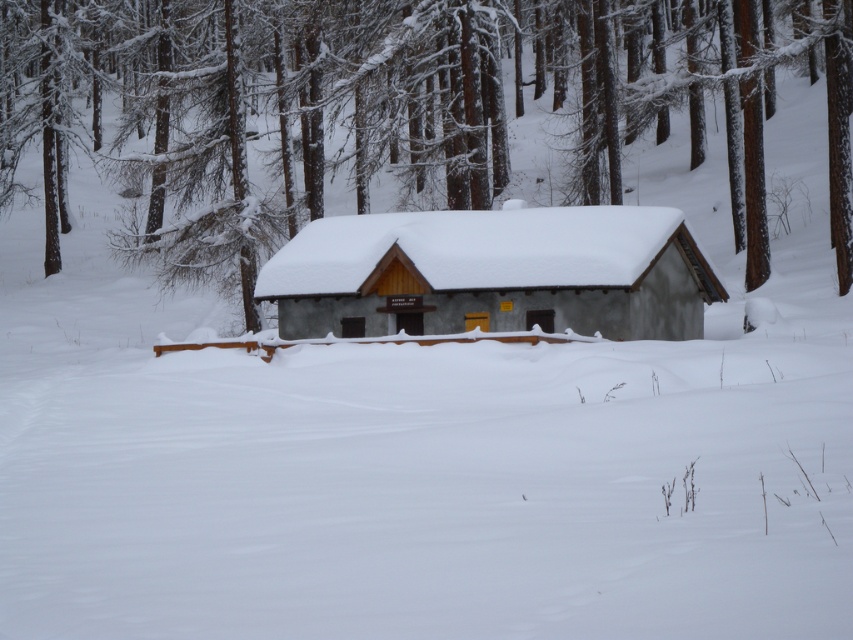
Does brown wood tree at center appear under smooth gray cabin at center?

Incorrect, brown wood tree at center is not positioned below smooth gray cabin at center.

Does brown wood tree at center lie in front of smooth gray cabin at center?

No, brown wood tree at center is behind smooth gray cabin at center.

The height and width of the screenshot is (640, 853). What do you see at coordinates (392, 106) in the screenshot?
I see `brown wood tree at center` at bounding box center [392, 106].

I want to click on brown wood tree at center, so click(x=392, y=106).